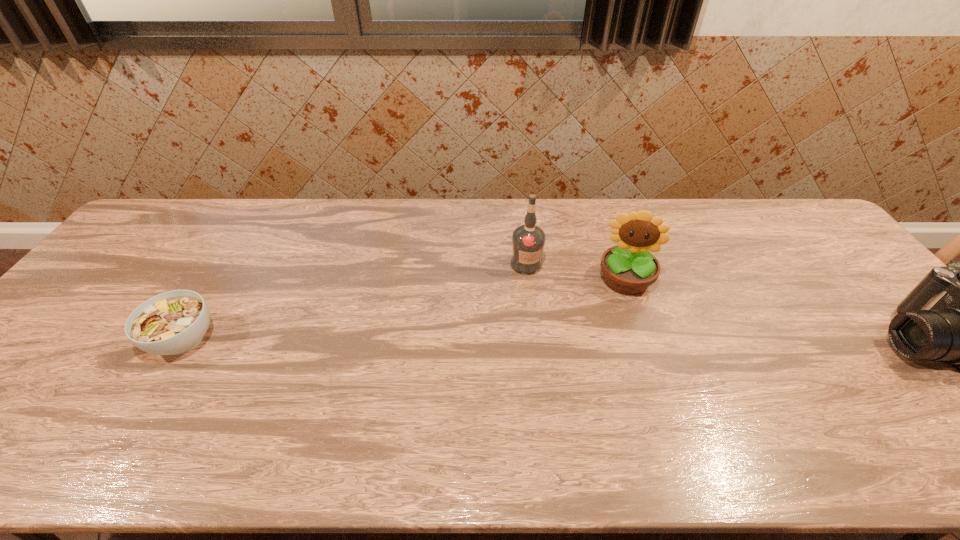
Image resolution: width=960 pixels, height=540 pixels. I want to click on free area in between the third object from right to left and the soup bowl, so click(x=355, y=302).

I want to click on object that is the nearest to the leftmost object, so click(x=528, y=240).

Identify the location of object that is the nearest to the third tallest object. (629, 268).

Locate an element on the screen. Image resolution: width=960 pixels, height=540 pixels. vacant region that satisfies the following two spatial constraints: 1. on the back side of the vodka; 2. on the left side of the leftmost object is located at coordinates (229, 264).